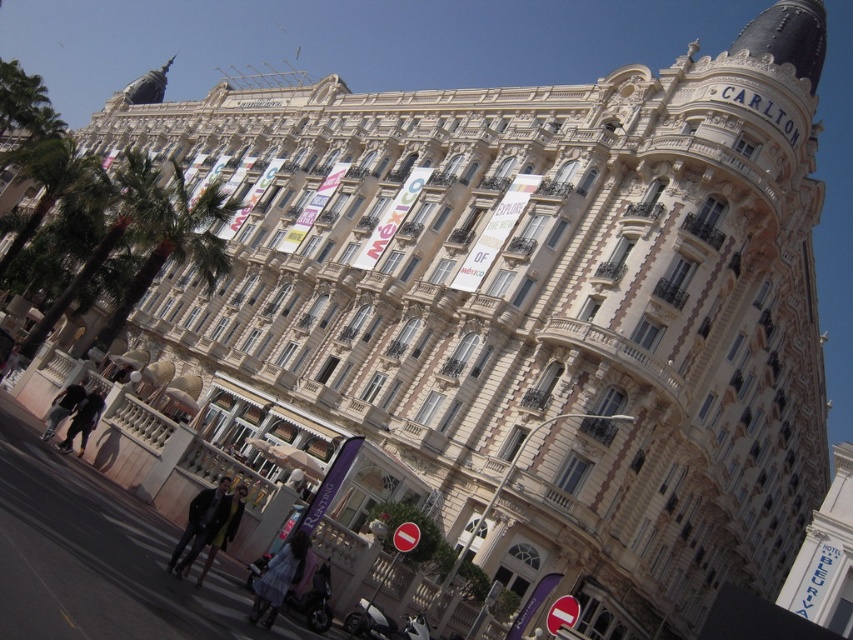
You are a photographer standing in front of the Carlton building. You notice two people wearing leather clothing. One is wearing a leather jacket at lower center and the other has black leather pants at lower left. Which piece of clothing is positioned lower in the image?

The leather jacket at lower center is located below the black leather pants at lower left, so the leather jacket at lower center is positioned lower in the image.

You are a photographer positioned at the edge of the street. You want to capture both the light blue denim dress at lower center and the dark brown leather jacket at lower left in your shot. Which object should you adjust your camera to focus on first to ensure both are in frame?

You should focus on the dark brown leather jacket at lower left first because it is located to the left of the light blue denim dress at lower center, ensuring both are included in the frame when adjusting from left to right.